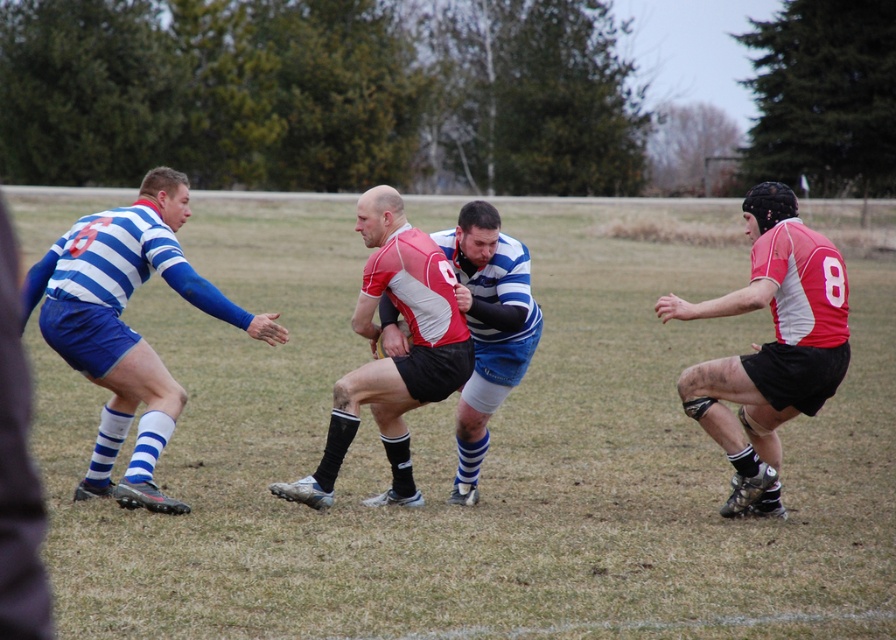
Question: Among these objects, which one is farthest from the camera?

Choices:
 (A) blue striped jersey at left
 (B) green grass at center
 (C) white jersey at center
 (D) red matte jersey at right

Answer: (C)

Question: Is red matte jersey at right to the right of red and white jersey at center from the viewer's perspective?

Choices:
 (A) no
 (B) yes

Answer: (B)

Question: Does green grass at center appear on the left side of blue striped jersey at left?

Choices:
 (A) yes
 (B) no

Answer: (B)

Question: Which of the following is the farthest from the observer?

Choices:
 (A) (510, 346)
 (B) (97, 234)
 (C) (35, 241)
 (D) (750, 426)

Answer: (C)

Question: Can you confirm if red matte jersey at right is positioned below white jersey at center?

Choices:
 (A) no
 (B) yes

Answer: (A)

Question: Considering the real-world distances, which object is farthest from the red matte jersey at right?

Choices:
 (A) red and white jersey at center
 (B) green grass at center

Answer: (B)